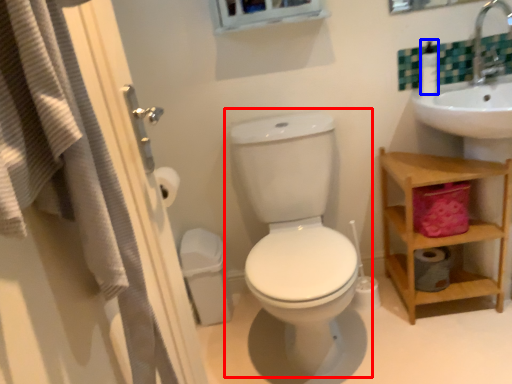
Question: Which point is further to the camera, toilet (highlighted by a red box) or soap dispenser (highlighted by a blue box)?

Choices:
 (A) toilet
 (B) soap dispenser

Answer: (B)